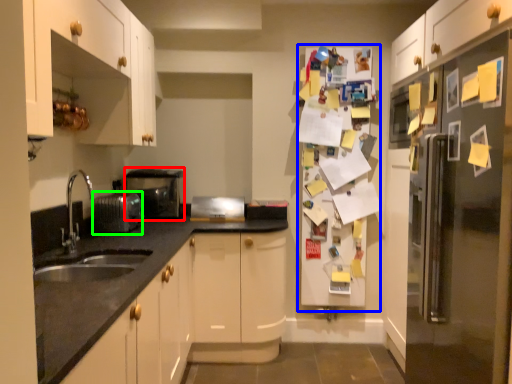
Question: Which is farther away from appliance (highlighted by a red box)? fridge (highlighted by a blue box) or appliance (highlighted by a green box)?

Choices:
 (A) fridge
 (B) appliance

Answer: (A)